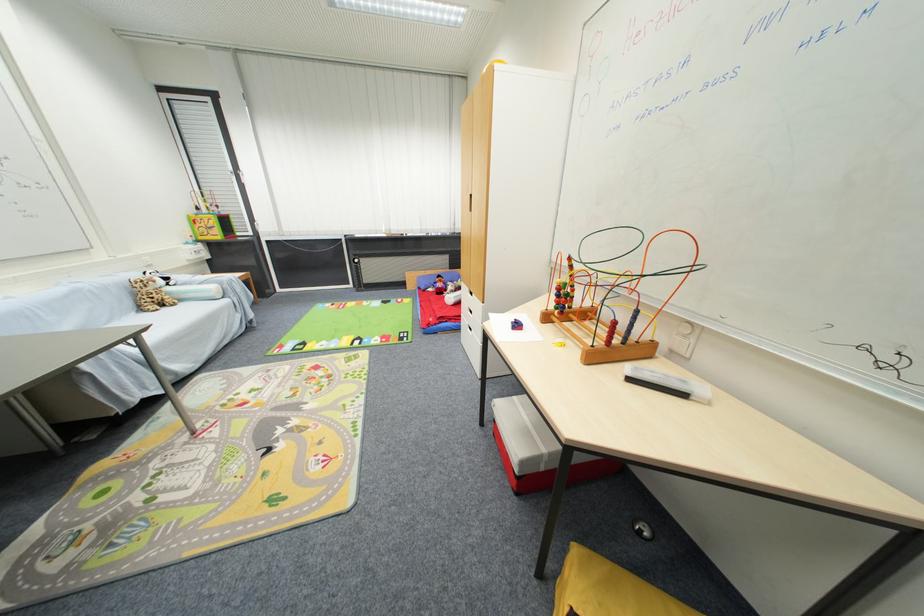
This screenshot has width=924, height=616. What are the coordinates of `panda stuffed toy` in the screenshot? It's located at (150, 293).